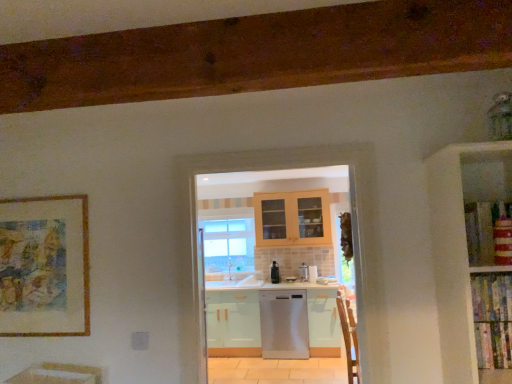
Question: Is satin silver dishwasher at center directly adjacent to wooden armchair at right?

Choices:
 (A) no
 (B) yes

Answer: (A)

Question: Are satin silver dishwasher at center and wooden armchair at right located far from each other?

Choices:
 (A) no
 (B) yes

Answer: (B)

Question: From the image's perspective, is satin silver dishwasher at center on wooden armchair at right?

Choices:
 (A) no
 (B) yes

Answer: (B)

Question: From a real-world perspective, is satin silver dishwasher at center on wooden armchair at right?

Choices:
 (A) yes
 (B) no

Answer: (A)

Question: Can you confirm if satin silver dishwasher at center is wider than wooden armchair at right?

Choices:
 (A) no
 (B) yes

Answer: (B)

Question: Is satin silver dishwasher at center smaller than wooden armchair at right?

Choices:
 (A) yes
 (B) no

Answer: (A)

Question: Can you confirm if gold-framed artwork at left is positioned to the left of satin silver dishwasher at center?

Choices:
 (A) yes
 (B) no

Answer: (A)

Question: Is gold-framed artwork at left positioned before satin silver dishwasher at center?

Choices:
 (A) yes
 (B) no

Answer: (A)

Question: From the image's perspective, is gold-framed artwork at left above satin silver dishwasher at center?

Choices:
 (A) yes
 (B) no

Answer: (A)

Question: Is gold-framed artwork at left aimed at satin silver dishwasher at center?

Choices:
 (A) no
 (B) yes

Answer: (A)

Question: Is satin silver dishwasher at center located within gold-framed artwork at left?

Choices:
 (A) yes
 (B) no

Answer: (B)

Question: Does gold-framed artwork at left have a lesser width compared to satin silver dishwasher at center?

Choices:
 (A) yes
 (B) no

Answer: (A)

Question: Is satin black dishwasher at center taller than satin silver dishwasher at center?

Choices:
 (A) no
 (B) yes

Answer: (B)